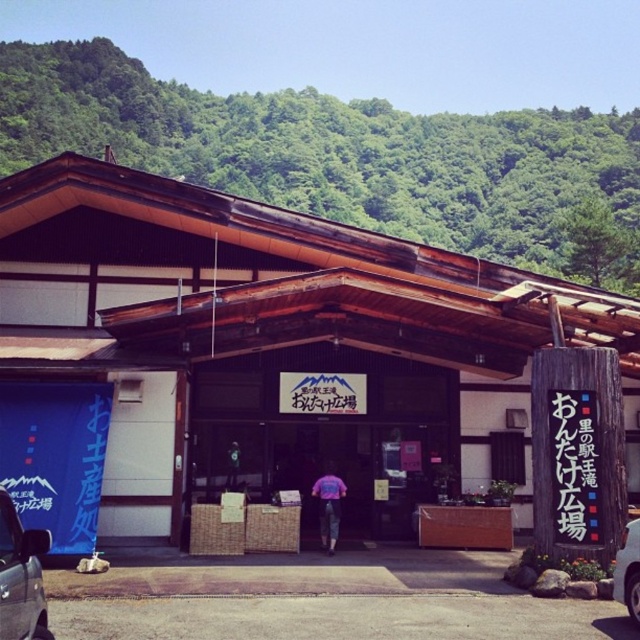
Between green leafy hillside at upper center and pink fabric jacket at center, which one has more height?

green leafy hillside at upper center is taller.

Is green leafy hillside at upper center wider than pink fabric jacket at center?

Yes.

Find the location of a particular element. Image resolution: width=640 pixels, height=640 pixels. green leafy hillside at upper center is located at coordinates (339, 154).

Can you confirm if white glossy car at lower right is shorter than pink fabric jacket at center?

Yes.

Does point (632, 586) lie behind point (326, 525)?

No, it is in front of (326, 525).

Between point (612, 593) and point (333, 477), which one is positioned in front?

Point (612, 593) is more forward.

Where is `white glossy car at lower right`? Image resolution: width=640 pixels, height=640 pixels. white glossy car at lower right is located at coordinates (627, 570).

Is point (38, 257) in front of point (525, 209)?

That is True.

Between point (218, 442) and point (573, 168), which one is positioned behind?

The point (573, 168) is more distant.

Is point (500, 291) closer to viewer compared to point (490, 124)?

Yes, point (500, 291) is in front of point (490, 124).

Where is `white wood store at center`? This screenshot has width=640, height=640. white wood store at center is located at coordinates coord(273,339).